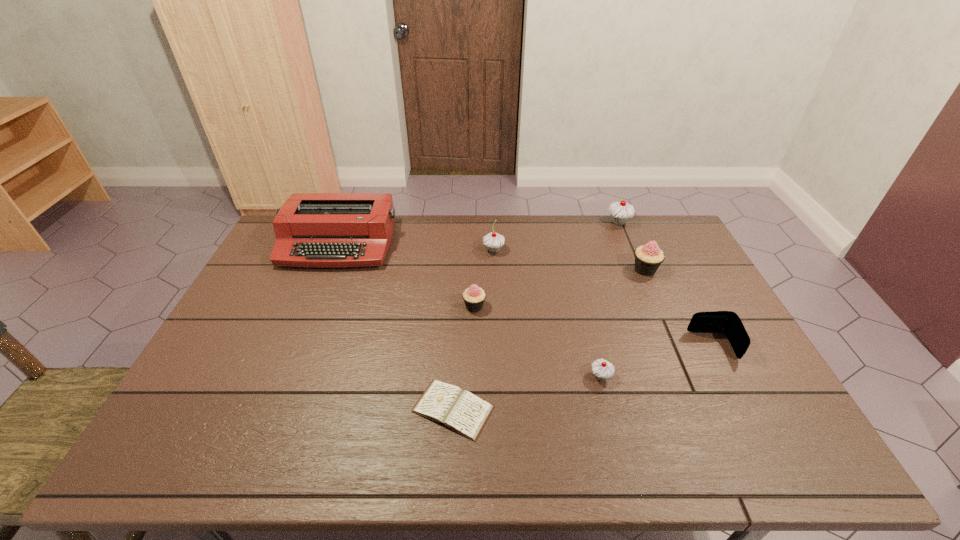
The image size is (960, 540). What are the coordinates of `empty space that is in between the third cupcake from left to right and the second nearest gray cupcake` in the screenshot? It's located at (547, 313).

Find the location of a particular element. The height and width of the screenshot is (540, 960). unoccupied area between the nearer pink cupcake and the bigger pink cupcake is located at coordinates (560, 288).

Where is `empty space that is in between the left pink cupcake and the second biggest gray cupcake`? empty space that is in between the left pink cupcake and the second biggest gray cupcake is located at coordinates (484, 278).

Identify which object is the fourth closest to the second farthest gray cupcake. Please provide its 2D coordinates. Your answer should be formatted as a tuple, i.e. [(x, y)], where the tuple contains the x and y coordinates of a point satisfying the conditions above.

[(648, 258)]

Select which object is the second closest to the red typewriter. Please provide its 2D coordinates. Your answer should be formatted as a tuple, i.e. [(x, y)], where the tuple contains the x and y coordinates of a point satisfying the conditions above.

[(493, 241)]

What are the coordinates of `cupcake that is the fourth closest to the leftmost gray cupcake` in the screenshot? It's located at pyautogui.click(x=602, y=369).

Locate which cupcake ranks fourth in proximity to the leftmost object. Please provide its 2D coordinates. Your answer should be formatted as a tuple, i.e. [(x, y)], where the tuple contains the x and y coordinates of a point satisfying the conditions above.

[(620, 212)]

This screenshot has width=960, height=540. What are the coordinates of `gray cupcake that is the second closest to the second smallest gray cupcake` in the screenshot? It's located at (602, 369).

Point out which gray cupcake is positioned as the nearest to the wallet. Please provide its 2D coordinates. Your answer should be formatted as a tuple, i.e. [(x, y)], where the tuple contains the x and y coordinates of a point satisfying the conditions above.

[(602, 369)]

Locate an element on the screen. The height and width of the screenshot is (540, 960). free spot that satisfies the following two spatial constraints: 1. on the typing side of the typewriter; 2. on the right side of the second nearest cupcake is located at coordinates (313, 307).